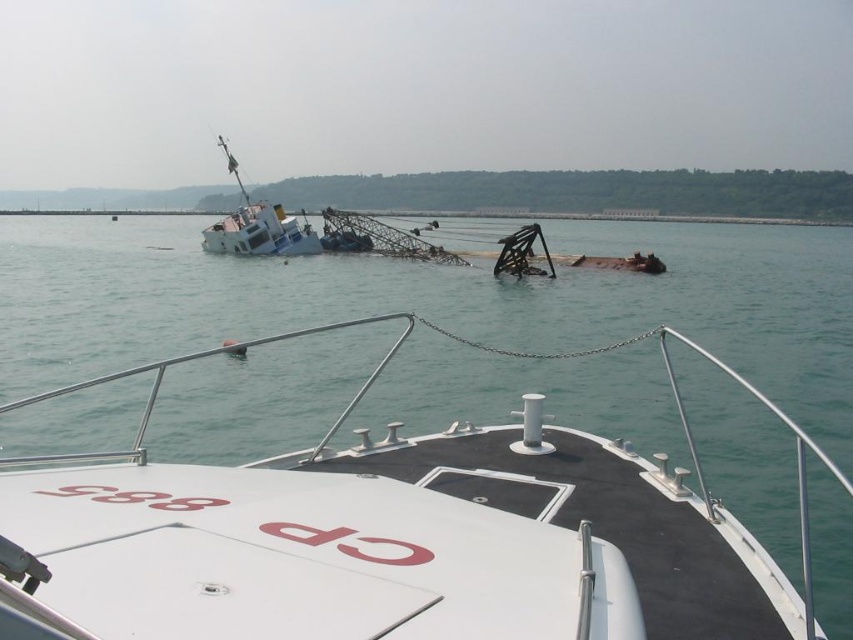
You are a marine biologist examining the shipwreck. You notice two points marked on your map at coordinates point [453,570] and point [258,212]. Which point is closer to your current position on the bow of the vessel with the red lettering CP 885?

Point [453,570] is closer to the camera than point [258,212], so the point [453,570] is closer to your current position on the bow of the vessel with the red lettering CP 885.

Consider the image. You are a sailor trying to navigate between the white matte boat at center and the white matte ship at left. Since the boat is shorter than the ship, which one do you think has a higher chance of being hidden by waves during rough seas?

The white matte boat at center is shorter than the white matte ship at left, so it has a higher chance of being hidden by waves during rough seas.

You are a sailor trying to navigate between the white matte boat at center and the white matte ship at left. Which direction should you steer to avoid collision?

You should steer to the left side of the white matte ship at left since the white matte boat at center is positioned on the right side of it, so moving left would keep you clear of both vessels.